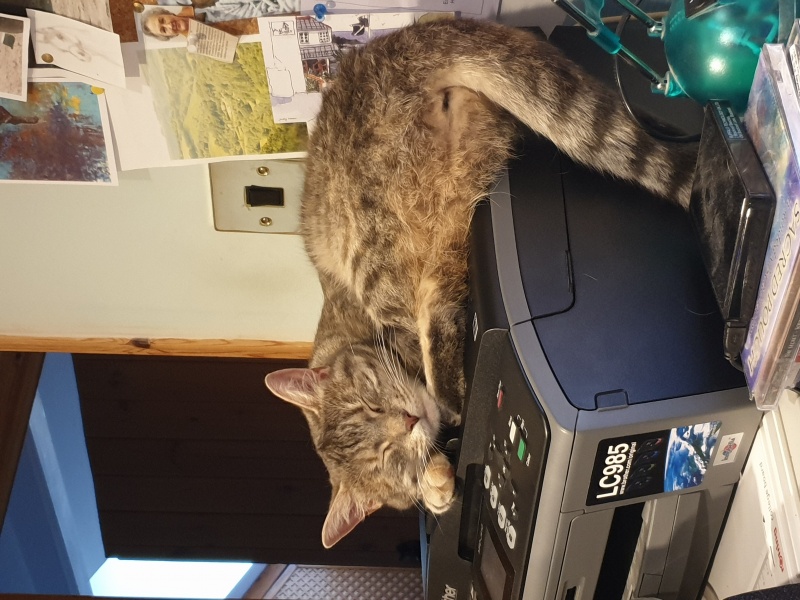
You are a GUI agent. You are given a task and a screenshot of the screen. Output one action in this format:
    pyautogui.click(x=<x>, y=<y>)
    Task: Click on the window
    
    Given the screenshot: What is the action you would take?
    pyautogui.click(x=162, y=581)